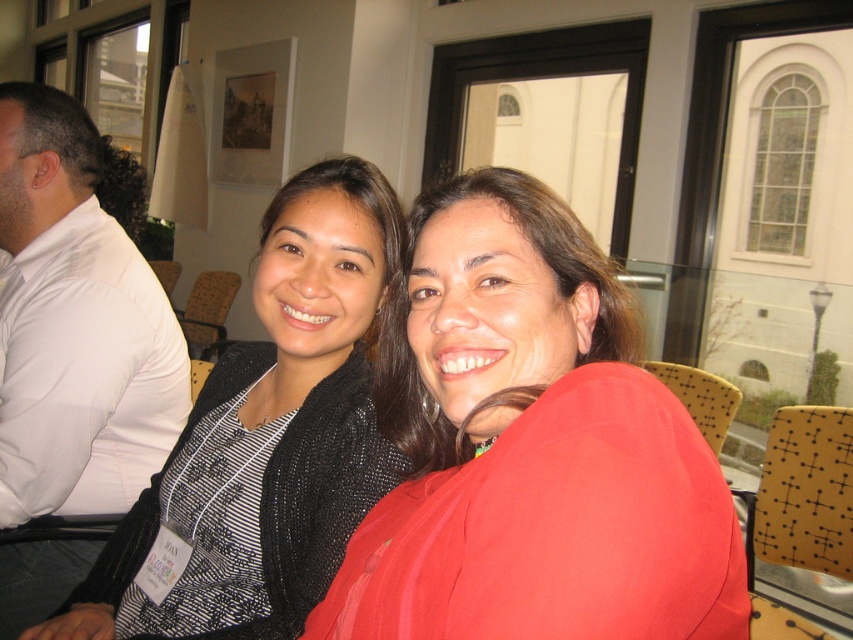
Is point (547, 200) positioned before point (317, 163)?

That is True.

Locate an element on the screen. matte black jacket at center is located at coordinates (532, 449).

What are the coordinates of `matte black jacket at center` in the screenshot? It's located at (532, 449).

Which is above, matte black jacket at center or white shirt at left?

white shirt at left is above.

Is point (393, 401) more distant than point (80, 296)?

No.

This screenshot has height=640, width=853. What do you see at coordinates (532, 449) in the screenshot?
I see `matte black jacket at center` at bounding box center [532, 449].

You are a GUI agent. You are given a task and a screenshot of the screen. Output one action in this format:
    pyautogui.click(x=<x>, y=<y>)
    Task: Click on the matte black jacket at center
    This screenshot has width=853, height=640.
    Given the screenshot: What is the action you would take?
    pyautogui.click(x=532, y=449)

Does black textured sweater at center have a greater height compared to white shirt at left?

In fact, black textured sweater at center may be shorter than white shirt at left.

This screenshot has width=853, height=640. What do you see at coordinates (265, 438) in the screenshot? I see `black textured sweater at center` at bounding box center [265, 438].

Is point (229, 595) in front of point (148, 262)?

Yes, point (229, 595) is closer to viewer.

Image resolution: width=853 pixels, height=640 pixels. What are the coordinates of `black textured sweater at center` in the screenshot? It's located at (265, 438).